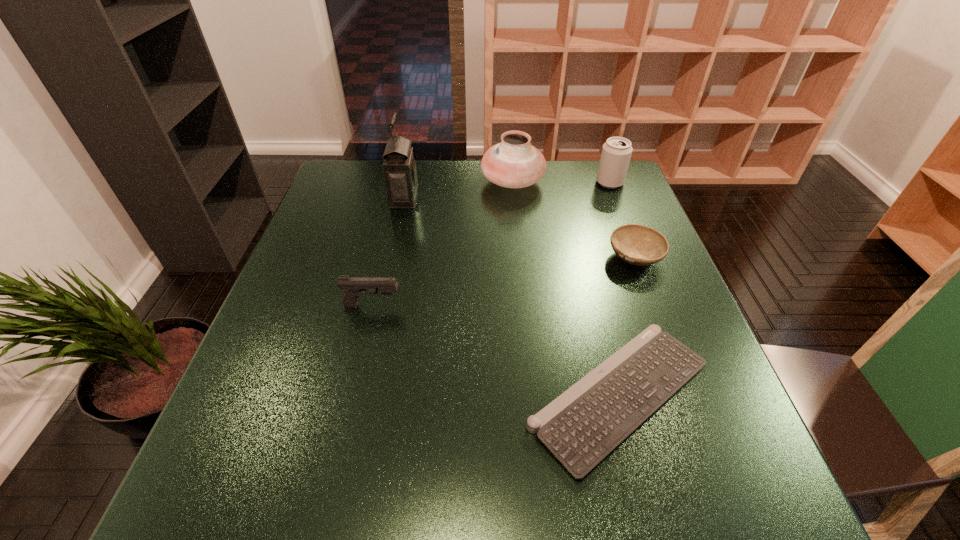
Image resolution: width=960 pixels, height=540 pixels. Find the location of `the tallest object`. the tallest object is located at coordinates (399, 167).

Identify the location of pottery. (514, 163).

Where is `can`? can is located at coordinates (616, 153).

Find the location of `pistol`. pistol is located at coordinates (354, 287).

Where is `the fourth tallest object`? the fourth tallest object is located at coordinates (354, 287).

Find the location of a particular element. the second shortest object is located at coordinates (639, 245).

Where is `bowl`? The height and width of the screenshot is (540, 960). bowl is located at coordinates (639, 245).

You are a GUI agent. You are given a task and a screenshot of the screen. Output one action in this format:
    pyautogui.click(x=<x>, y=<y>)
    Task: Click on the computer keyboard
    
    Given the screenshot: What is the action you would take?
    pyautogui.click(x=582, y=426)

Where is `the nearest object`? The image size is (960, 540). the nearest object is located at coordinates (582, 426).

Where is `vacant region located 0.330m on the front-facing side of the tallest object`? vacant region located 0.330m on the front-facing side of the tallest object is located at coordinates (532, 199).